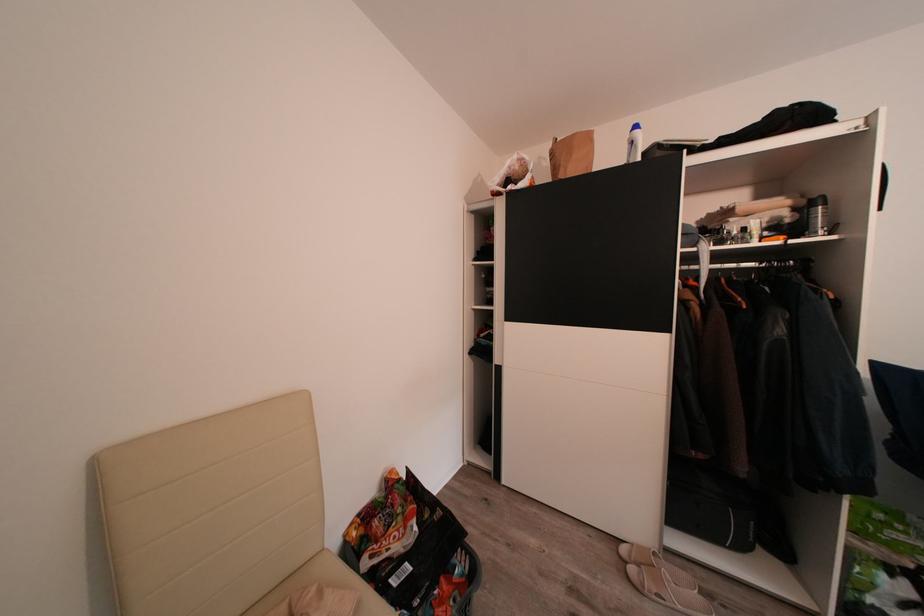
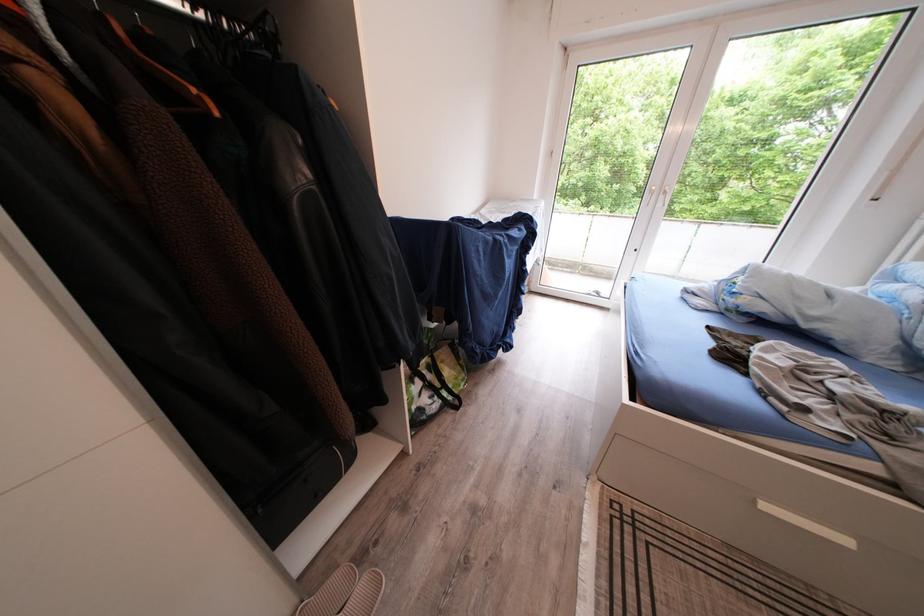
Locate, in the second image, the point that corresponds to [691,580] in the first image.

(347, 583)